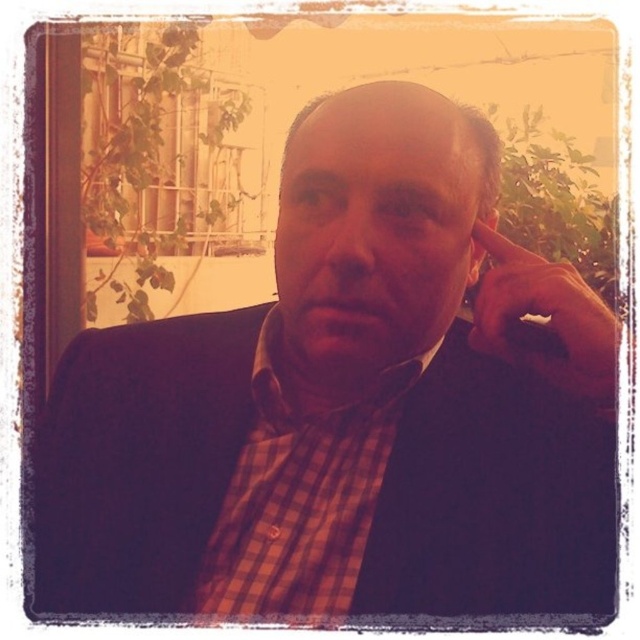
Question: Is checkered fabric dress shirt at center bigger than matte brown hand at upper right?

Choices:
 (A) yes
 (B) no

Answer: (A)

Question: Which of the following is the closest to the observer?

Choices:
 (A) matte brown hand at upper right
 (B) checkered fabric dress shirt at center

Answer: (A)

Question: Among these objects, which one is nearest to the camera?

Choices:
 (A) checkered fabric dress shirt at center
 (B) matte brown hand at upper right

Answer: (B)

Question: Is checkered fabric dress shirt at center bigger than matte brown hand at upper right?

Choices:
 (A) yes
 (B) no

Answer: (A)

Question: Which object is closer to the camera taking this photo?

Choices:
 (A) checkered fabric dress shirt at center
 (B) matte brown hand at upper right

Answer: (B)

Question: Observing the image, what is the correct spatial positioning of checkered fabric dress shirt at center in reference to matte brown hand at upper right?

Choices:
 (A) above
 (B) below

Answer: (B)